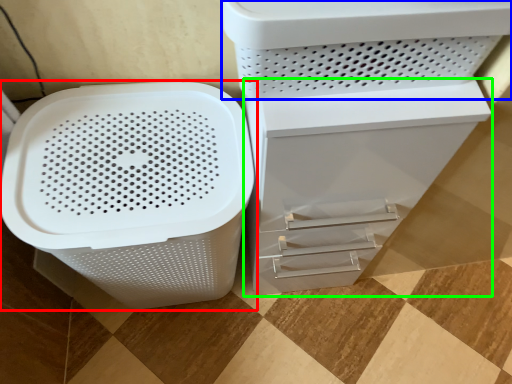
Question: Which object is positioned farthest from waste container (highlighted by a red box)? Select from appliance (highlighted by a blue box) and file cabinet (highlighted by a green box).

Choices:
 (A) appliance
 (B) file cabinet

Answer: (A)